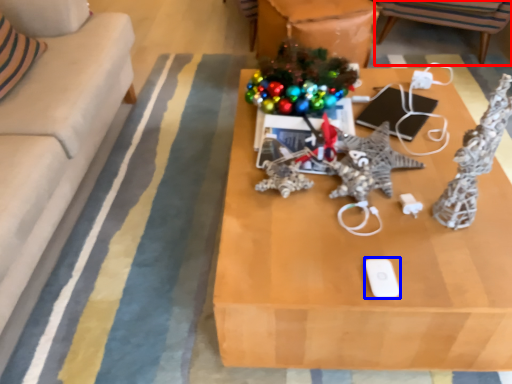
Question: Which object appears farthest to the camera in this image, chair (highlighted by a red box) or ipod (highlighted by a blue box)?

Choices:
 (A) chair
 (B) ipod

Answer: (A)